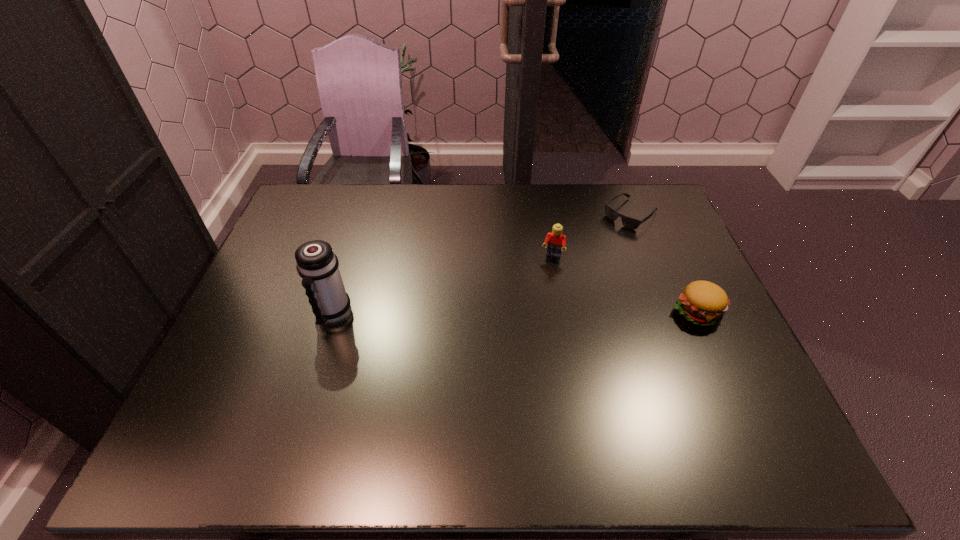
Locate an element on the screen. The image size is (960, 540). the tallest object is located at coordinates (317, 265).

This screenshot has width=960, height=540. I want to click on the leftmost object, so click(317, 265).

Locate an element on the screen. Image resolution: width=960 pixels, height=540 pixels. hamburger is located at coordinates (703, 303).

The image size is (960, 540). Identify the location of the second tallest object. (555, 240).

The image size is (960, 540). I want to click on the second farthest object, so click(x=555, y=240).

This screenshot has height=540, width=960. I want to click on sunglasses, so tap(632, 223).

In order to click on the shortest object in this screenshot , I will do `click(632, 223)`.

Where is `free space located on the side with the handle of the thermos bottle`? free space located on the side with the handle of the thermos bottle is located at coordinates (324, 348).

You are a GUI agent. You are given a task and a screenshot of the screen. Output one action in this format:
    pyautogui.click(x=<x>, y=<y>)
    Task: Click on the vacant space located 0.220m on the front of the third tallest object
    The height and width of the screenshot is (540, 960).
    Given the screenshot: What is the action you would take?
    pyautogui.click(x=741, y=409)

Identify the location of free point located 0.180m on the face of the second tallest object. click(x=538, y=305).